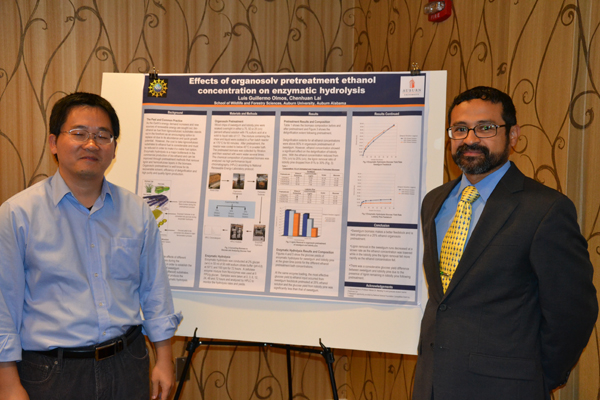
At what (x,y) coordinates should I click in order to perform the action: click on wall. Please return your answer as a coordinate pair (x, y). This screenshot has height=400, width=600. Looking at the image, I should click on (397, 25).